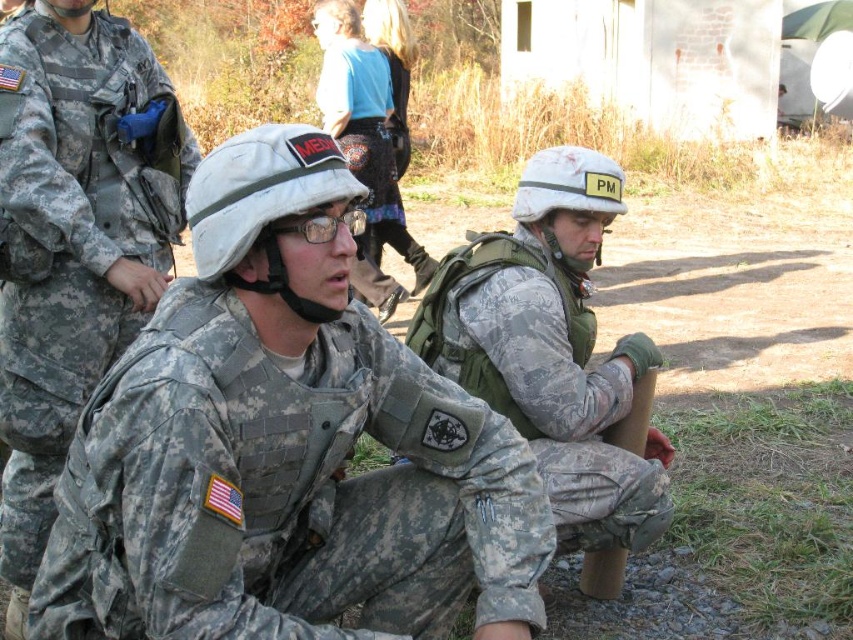
Question: Which point is farther to the camera?

Choices:
 (A) camouflage uniform at center
 (B) camouflage fabric uniform at center

Answer: (A)

Question: Among these objects, which one is farthest from the camera?

Choices:
 (A) camouflage fabric helmet at center
 (B) blue denim skirt at center
 (C) brushed metal backpack at center
 (D) camouflage uniform at center

Answer: (C)

Question: Does blue denim skirt at center appear under brushed metal backpack at center?

Choices:
 (A) no
 (B) yes

Answer: (A)

Question: Does camouflage fabric uniform at center appear under brushed metal backpack at center?

Choices:
 (A) no
 (B) yes

Answer: (B)

Question: Can you confirm if camouflage fabric uniform at center is thinner than camouflage fabric helmet at center?

Choices:
 (A) no
 (B) yes

Answer: (A)

Question: Considering the real-world distances, which object is closest to the camouflage uniform at center?

Choices:
 (A) blue denim skirt at center
 (B) camouflage fabric uniform at center
 (C) brushed metal backpack at center
 (D) camouflage fabric helmet at center

Answer: (B)